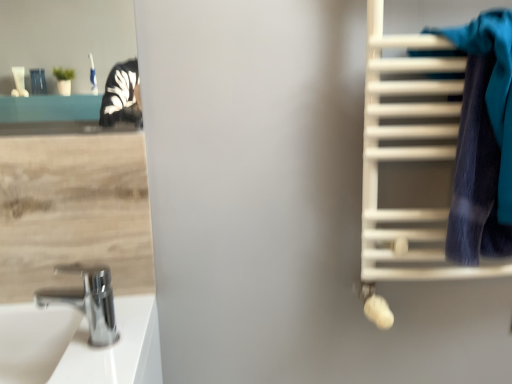
Question: Is white matte towel rack at right next to chrome metallic faucet at lower left and touching it?

Choices:
 (A) no
 (B) yes

Answer: (A)

Question: From a real-world perspective, is white matte towel rack at right physically below chrome metallic faucet at lower left?

Choices:
 (A) yes
 (B) no

Answer: (B)

Question: From the image's perspective, is white matte towel rack at right above chrome metallic faucet at lower left?

Choices:
 (A) yes
 (B) no

Answer: (A)

Question: Is white matte towel rack at right positioned with its back to chrome metallic faucet at lower left?

Choices:
 (A) no
 (B) yes

Answer: (A)

Question: Is white matte towel rack at right not within chrome metallic faucet at lower left?

Choices:
 (A) yes
 (B) no

Answer: (A)

Question: Considering the positions of blue fabric towel at right and chrome metallic faucet at lower left in the image, is blue fabric towel at right bigger or smaller than chrome metallic faucet at lower left?

Choices:
 (A) small
 (B) big

Answer: (B)

Question: Is blue fabric towel at right taller or shorter than chrome metallic faucet at lower left?

Choices:
 (A) tall
 (B) short

Answer: (A)

Question: Is point (457, 213) closer or farther from the camera than point (55, 292)?

Choices:
 (A) farther
 (B) closer

Answer: (B)

Question: Is blue fabric towel at right in front of or behind chrome metallic faucet at lower left in the image?

Choices:
 (A) behind
 (B) front

Answer: (B)

Question: From the image's perspective, relative to blue fabric towel at right, is white glossy sink at lower left above or below?

Choices:
 (A) below
 (B) above

Answer: (A)

Question: Is white glossy sink at lower left in front of or behind blue fabric towel at right in the image?

Choices:
 (A) front
 (B) behind

Answer: (B)

Question: Would you say white glossy sink at lower left is inside or outside blue fabric towel at right?

Choices:
 (A) inside
 (B) outside

Answer: (B)

Question: From a real-world perspective, is white glossy sink at lower left positioned above or below blue fabric towel at right?

Choices:
 (A) below
 (B) above

Answer: (A)

Question: From their relative heights in the image, would you say white matte towel rack at right is taller or shorter than white glossy sink at lower left?

Choices:
 (A) tall
 (B) short

Answer: (A)

Question: Does point (362, 213) appear closer or farther from the camera than point (33, 349)?

Choices:
 (A) farther
 (B) closer

Answer: (A)